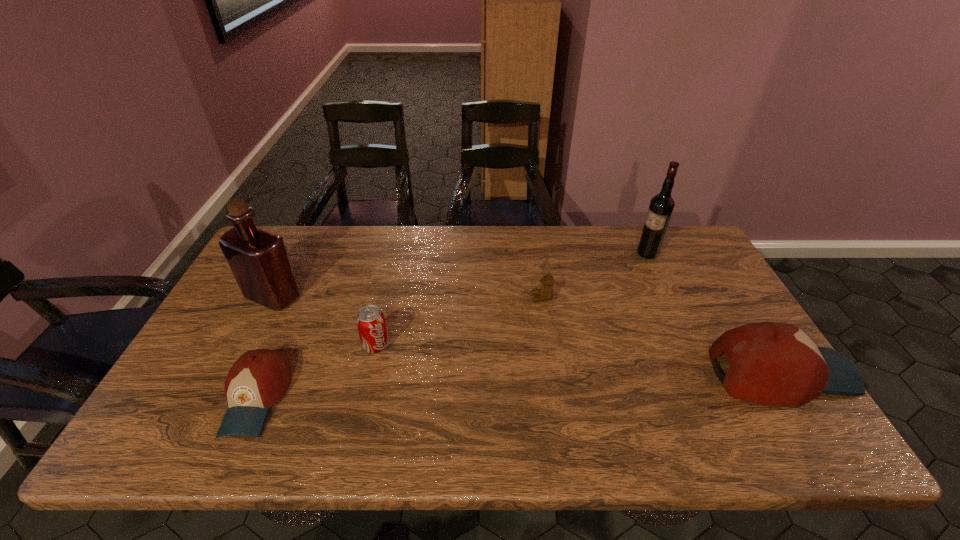
The height and width of the screenshot is (540, 960). Find the location of `the left baseball cap`. the left baseball cap is located at coordinates (259, 378).

This screenshot has width=960, height=540. Identify the location of the fourth shortest object. (775, 364).

Locate an element on the screen. the right baseball cap is located at coordinates (775, 364).

Locate an element on the screen. the fourth object from left to right is located at coordinates (546, 292).

Where is `the farthest object`? the farthest object is located at coordinates (661, 207).

What are the coordinates of `liquor` in the screenshot? It's located at (259, 260).

Locate an element on the screen. the third object from left to right is located at coordinates (370, 320).

Locate an element on the screen. the third shortest object is located at coordinates (370, 320).

The height and width of the screenshot is (540, 960). In order to click on free space located on the front-facing side of the teddy bear in this screenshot , I will do `click(498, 298)`.

The height and width of the screenshot is (540, 960). In order to click on vacant space located 0.170m on the front-facing side of the teddy bear in this screenshot , I will do `click(474, 298)`.